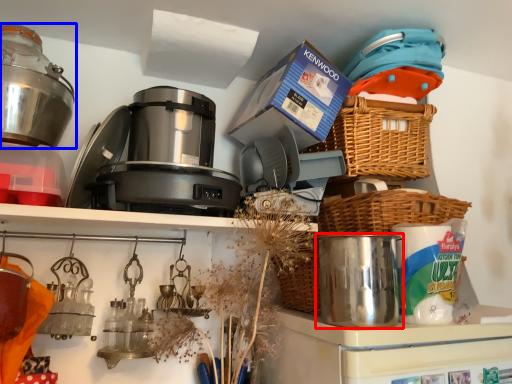
Question: Which point is closer to the camera, appliance (highlighted by a red box) or kitchen appliance (highlighted by a blue box)?

Choices:
 (A) appliance
 (B) kitchen appliance

Answer: (A)